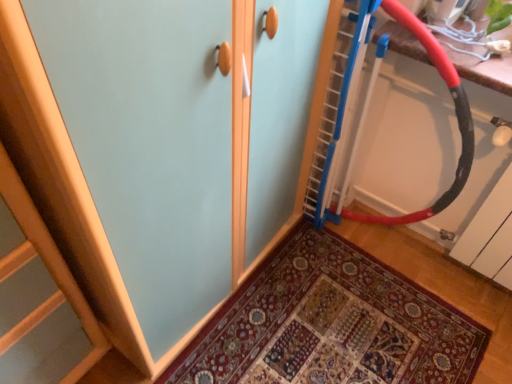
Locate an element on the screen. Image resolution: width=512 pixels, height=384 pixels. vacant region in front of red rubber battle rope at upper right is located at coordinates (365, 304).